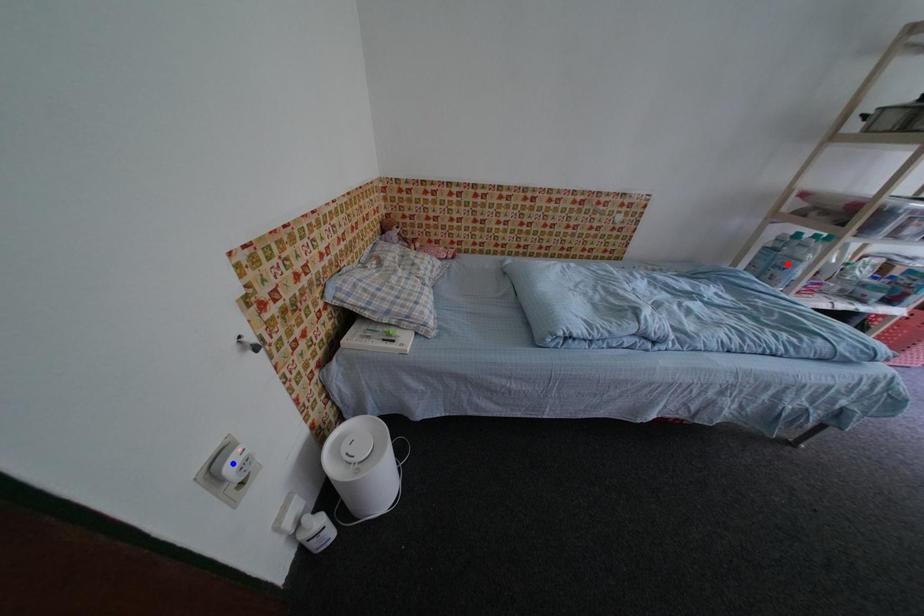
Question: Which of the two points in the image is closer to the camera?

Choices:
 (A) Blue point is closer.
 (B) Red point is closer.

Answer: (A)